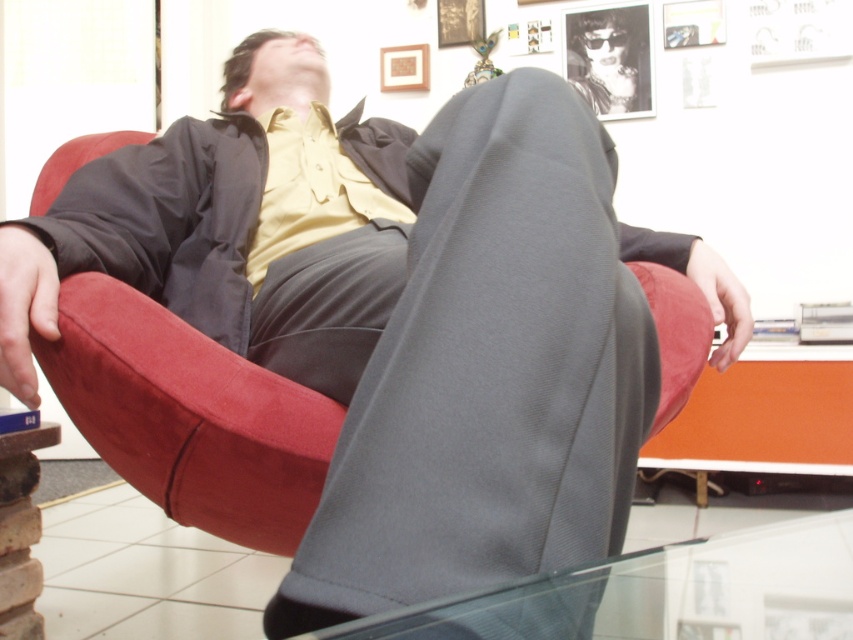
You are a photographer setting up a shoot in the room. You need to place a tripod exactly at the center of the room. The velvet red bean bag chair at center is currently blocking that spot. Can you move the chair to a position that is not blocking the center while keeping it within the room?

The velvet red bean bag chair at center is located at point (189, 417), which is not the exact center of the room. Moving it slightly towards the center coordinates might still block the spot, but adjusting it away from the center point would allow the tripod to be placed there. However, since the exact center coordinates are unknown, the safest way is to move the velvet red bean bag chair at center to a position closer to the edges or corners of the room to ensure it doesn not block the center.

You are planning to place a rectangular coffee table that is 1.2 meters wide in the living room. You see the velvet red bean bag chair at center and the transparent glass table at lower center. Which object has enough space to accommodate the coffee table next to it?

The transparent glass table at lower center has a greater width than the velvet red bean bag chair at center, so the coffee table can be placed next to the transparent glass table at lower center since it is wider and likely has more space available.